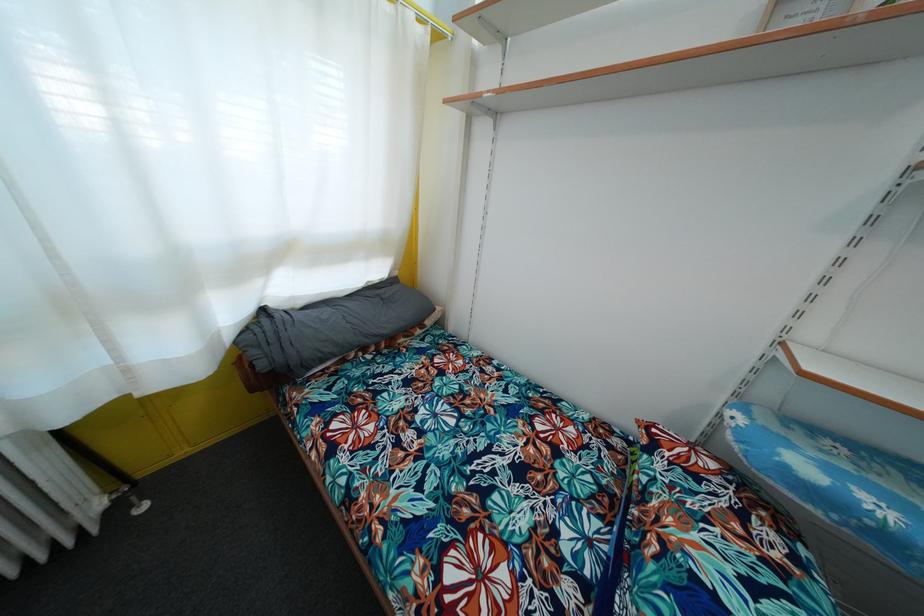
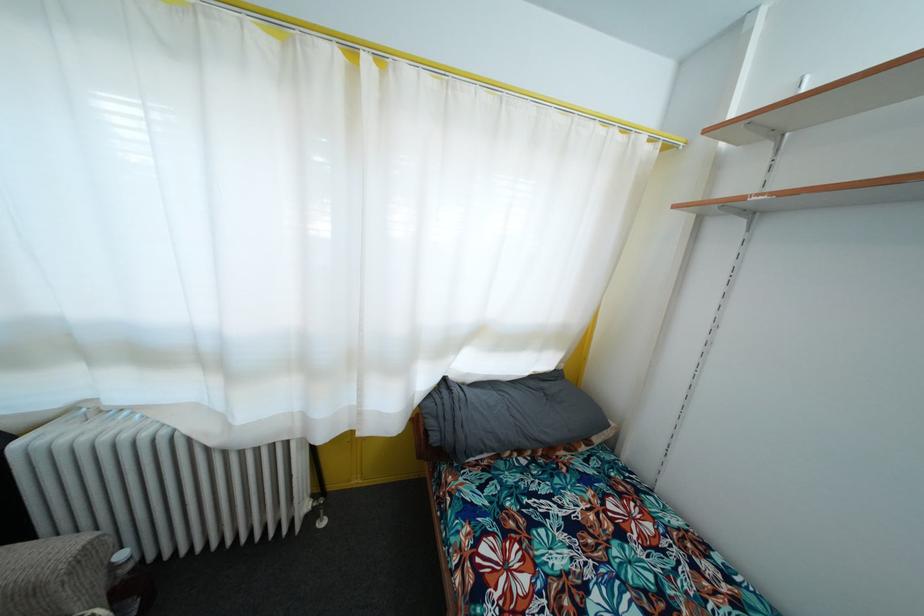
Question: The camera is either moving clockwise (left) or counter-clockwise (right) around the object. The first image is from the beginning of the video and the second image is from the end. Is the camera moving left or right when shooting the video?

Choices:
 (A) Left
 (B) Right

Answer: (B)